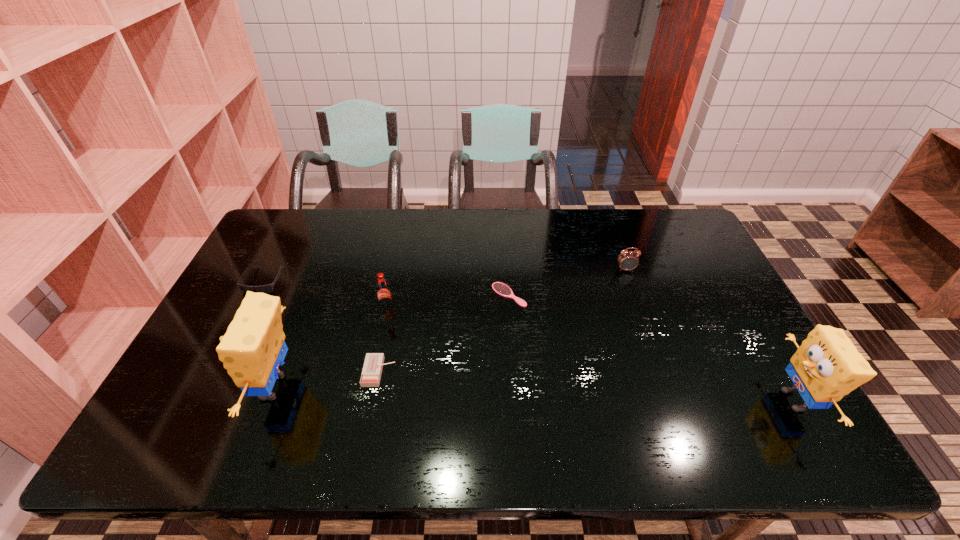
Image resolution: width=960 pixels, height=540 pixels. Find the location of `root beer`. root beer is located at coordinates (384, 295).

Find the location of a particular element. The width and height of the screenshot is (960, 540). matchbox is located at coordinates (371, 374).

This screenshot has width=960, height=540. What are the coordinates of `vacant area situated on the face of the taller sponge` in the screenshot? It's located at (221, 387).

At what (x,y) coordinates should I click in order to perform the action: click on free space located 0.070m on the face of the taller sponge. Please return your answer as a coordinate pair (x, y). The height and width of the screenshot is (540, 960). Looking at the image, I should click on (221, 387).

Identify the location of vacant space located 0.180m on the face of the taller sponge. The image size is (960, 540). (177, 387).

What are the coordinates of `free space located on the face of the right sponge` in the screenshot? It's located at (699, 400).

Identify the location of vacant region located 0.390m on the face of the right sponge. (612, 400).

You are a GUI agent. You are given a task and a screenshot of the screen. Output one action in this format:
    pyautogui.click(x=<x>, y=<y>)
    Task: Click on the vacant space located 0.160m on the face of the right sponge
    The image size is (960, 540).
    Given the screenshot: What is the action you would take?
    pyautogui.click(x=708, y=400)

Identify the location of free spot located 0.210m on the face of the alarm clock. (645, 322).

At what (x,y) coordinates should I click in order to perform the action: click on free space located 0.120m on the front-facing side of the third shortest object. Please return your answer as a coordinate pair (x, y). Looking at the image, I should click on (241, 325).